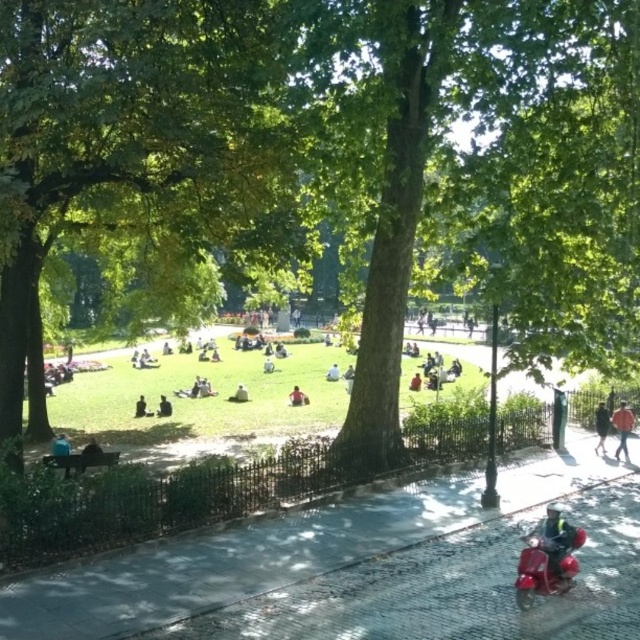
Question: Which object appears closest to the camera in this image?

Choices:
 (A) matte black jacket at center
 (B) dark blue jeans at right
 (C) green leafy tree at center

Answer: (C)

Question: Considering the relative positions of blue fabric bag at lower left and matte black jacket at center in the image provided, where is blue fabric bag at lower left located with respect to matte black jacket at center?

Choices:
 (A) above
 (B) below

Answer: (B)

Question: Among these objects, which one is nearest to the camera?

Choices:
 (A) light brown leather jacket at center
 (B) dark gray fabric jacket at lower left
 (C) blue fabric bag at lower left
 (D) orange fabric jacket at lower right

Answer: (C)

Question: Can you confirm if orange fabric jacket at lower right is positioned below dark gray fabric jacket at lower left?

Choices:
 (A) no
 (B) yes

Answer: (A)

Question: Which object is closer to the camera taking this photo?

Choices:
 (A) dark brown leather jacket at lower left
 (B) dark blue jeans at right

Answer: (A)

Question: In this image, where is dark blue jeans at right located relative to blue fabric bag at lower left?

Choices:
 (A) below
 (B) above

Answer: (B)